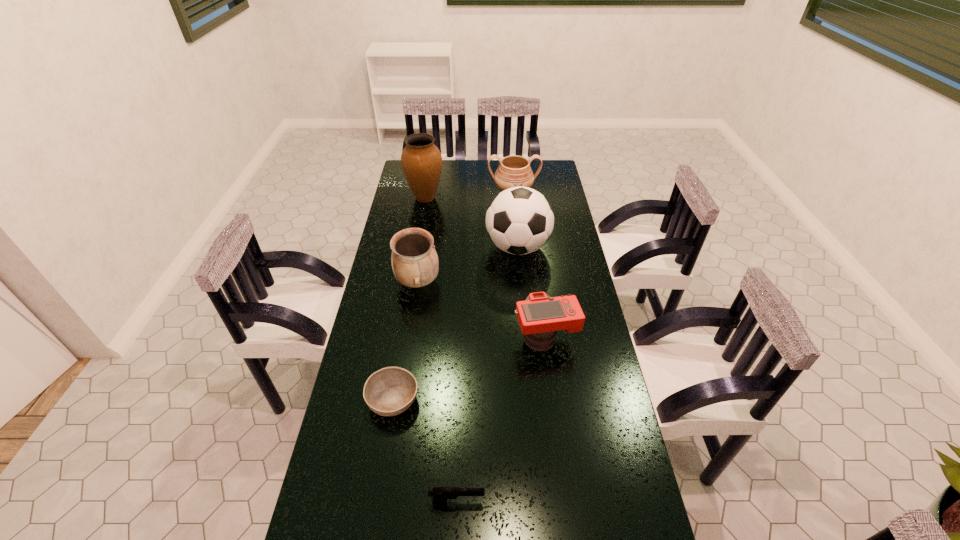
Locate an element on the screen. The height and width of the screenshot is (540, 960). vacant area between the fifth tallest object and the rightmost urn is located at coordinates (529, 266).

Locate an element on the screen. This screenshot has height=540, width=960. vacant space that's between the nearest object and the fifth tallest object is located at coordinates (501, 420).

Locate an element on the screen. The width and height of the screenshot is (960, 540). unoccupied position between the bowl and the tallest urn is located at coordinates tap(409, 299).

The height and width of the screenshot is (540, 960). In order to click on empty space between the soccer ball and the tallest urn in this screenshot , I will do `click(471, 222)`.

Where is `free space between the camera and the rightmost urn`? The height and width of the screenshot is (540, 960). free space between the camera and the rightmost urn is located at coordinates (529, 266).

At what (x,y) coordinates should I click in order to perform the action: click on empty location between the nearest urn and the fifth farthest object. Please return your answer as a coordinate pair (x, y). The width and height of the screenshot is (960, 540). Looking at the image, I should click on (481, 310).

I want to click on object that stands as the third closest to the nearest urn, so 390,391.

In order to click on object that is the fourth closest to the tallest urn in this screenshot , I will do `click(540, 316)`.

At what (x,y) coordinates should I click in order to perform the action: click on the second closest urn to the camera. Please return your answer as a coordinate pair (x, y). The image size is (960, 540). Looking at the image, I should click on (514, 171).

Locate an element on the screen. Image resolution: width=960 pixels, height=540 pixels. urn that is the second closest one to the soccer ball is located at coordinates (514, 171).